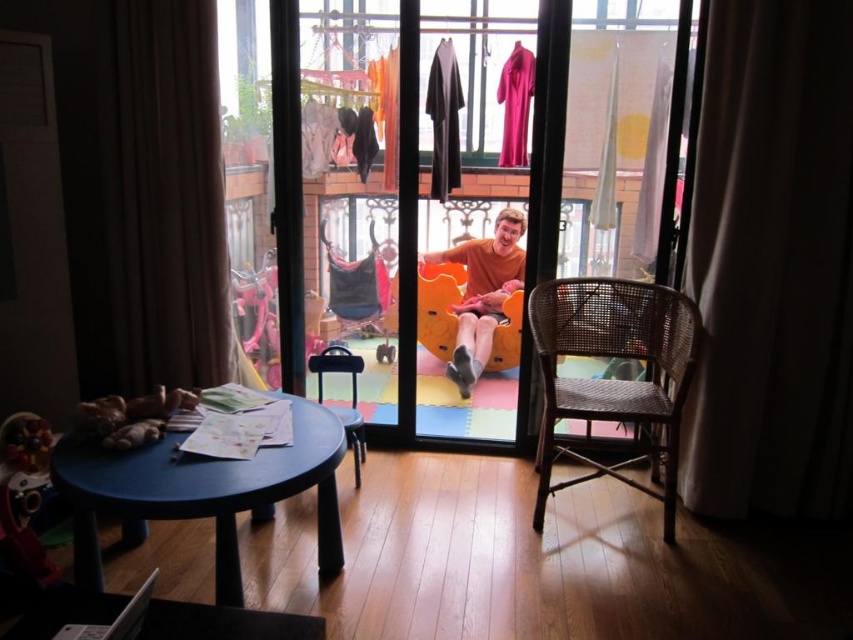
Can you confirm if white fabric curtain at right is positioned below blue plastic table at lower left?

No.

In the scene shown: Which is more to the left, white fabric curtain at right or blue plastic table at lower left?

blue plastic table at lower left is more to the left.

Which is behind, point (776, 29) or point (77, 506)?

The point (776, 29) is more distant.

This screenshot has width=853, height=640. In order to click on white fabric curtain at right in this screenshot , I will do `click(772, 262)`.

Does blue plastic table at lower left have a greater height compared to woven brown chair at right?

Incorrect, blue plastic table at lower left's height is not larger of woven brown chair at right's.

Who is lower down, blue plastic table at lower left or woven brown chair at right?

blue plastic table at lower left is below.

Who is more forward, (256, 461) or (679, 417)?

Point (256, 461)

Identify the location of blue plastic table at lower left. The width and height of the screenshot is (853, 640). (202, 493).

Consider the image. Can you confirm if transparent plastic glass door at center is positioned above soft plush toys at lower left?

Yes, transparent plastic glass door at center is above soft plush toys at lower left.

Based on the photo, does transparent plastic glass door at center appear on the right side of soft plush toys at lower left?

Indeed, transparent plastic glass door at center is positioned on the right side of soft plush toys at lower left.

What do you see at coordinates (401, 214) in the screenshot?
I see `transparent plastic glass door at center` at bounding box center [401, 214].

Identify the location of transparent plastic glass door at center. The width and height of the screenshot is (853, 640). (401, 214).